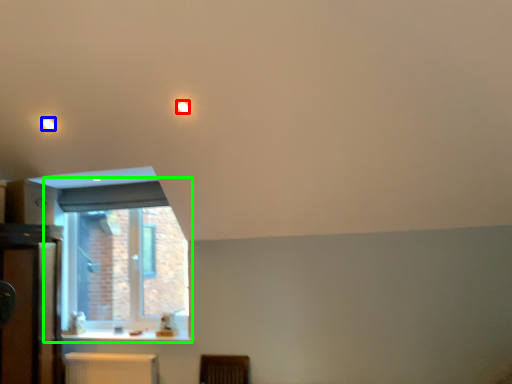
Question: Which is nearer to the lighting (highlighted by a red box)? lighting (highlighted by a blue box) or window (highlighted by a green box).

Choices:
 (A) lighting
 (B) window

Answer: (A)